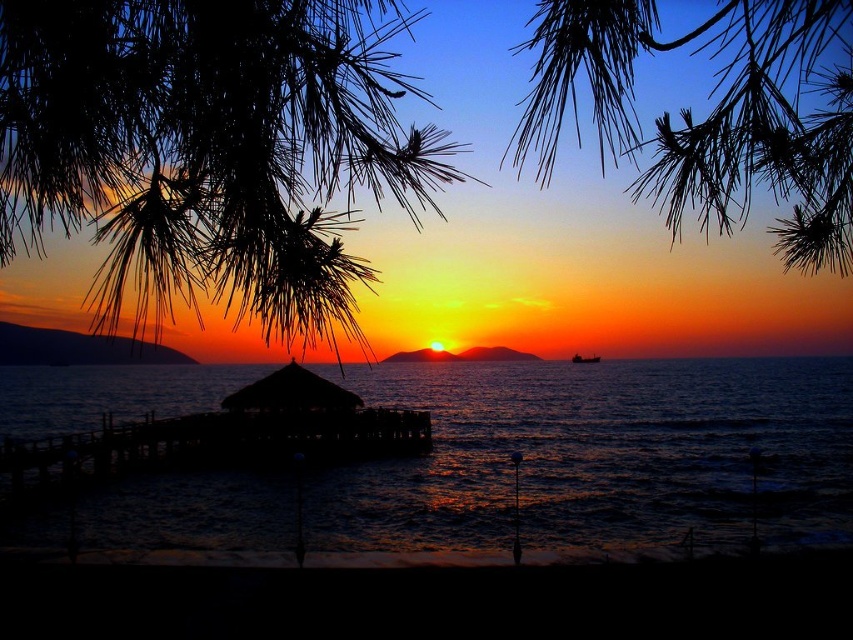
You are standing on the wooden pier and want to place a small wooden bench between the dark blue water at center and the silhouette thatched hut at center. Which object should you place the bench closer to if you want it to be equidistant from both?

You should place the bench closer to the silhouette thatched hut at center because the dark blue water at center is wider, so the distance between them requires the bench to be nearer to the narrower object to maintain equal distance.